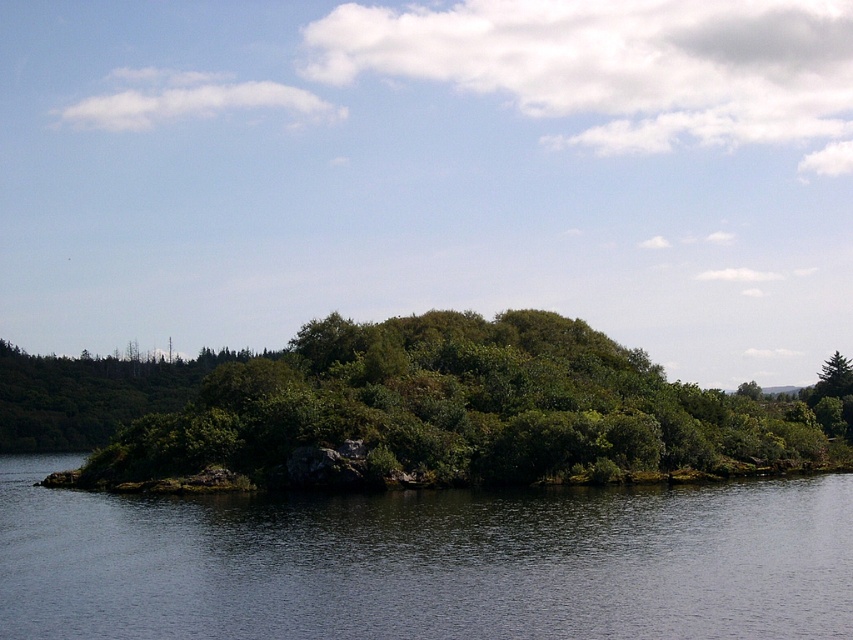
Between transparent water at center and green leafy bush at center, which one is positioned higher?

Positioned higher is green leafy bush at center.

Between transparent water at center and green leafy bush at center, which one is positioned lower?

Positioned lower is transparent water at center.

Who is more distant from viewer, (669, 576) or (323, 372)?

The point (323, 372) is behind.

At what (x,y) coordinates should I click in order to perform the action: click on transparent water at center. Please return your answer as a coordinate pair (x, y). Looking at the image, I should click on (426, 561).